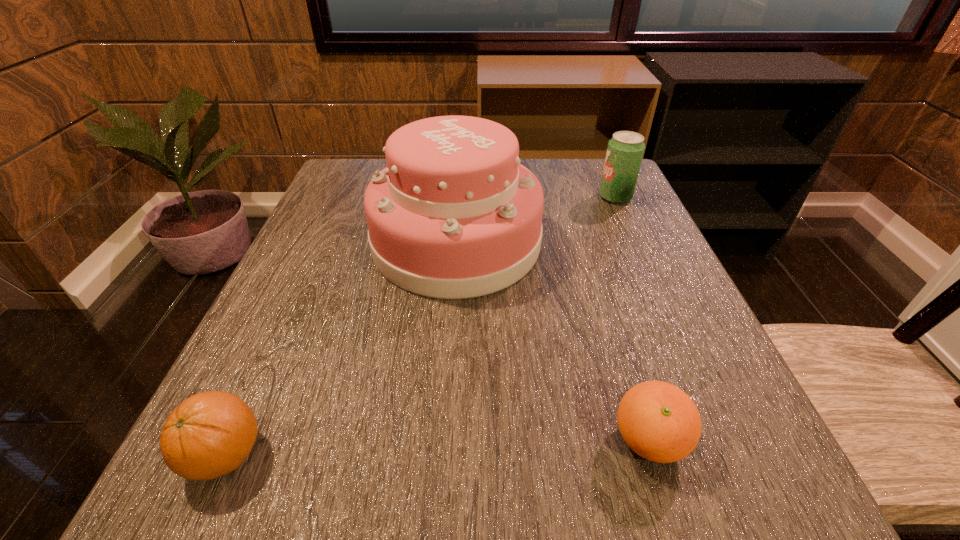
Find the location of a particular element. birthday cake is located at coordinates (454, 215).

Where is `the second object from left to right`? the second object from left to right is located at coordinates (454, 215).

Find the location of `soda`. soda is located at coordinates (625, 150).

Image resolution: width=960 pixels, height=540 pixels. What are the coordinates of `the rightmost object` in the screenshot? It's located at (625, 150).

Where is `the left orange`? This screenshot has height=540, width=960. the left orange is located at coordinates (210, 434).

Where is `the third object from left to right`? the third object from left to right is located at coordinates (658, 421).

Locate an element on the screen. This screenshot has width=960, height=540. vacant space positioned 0.180m on the front of the tallest object is located at coordinates (446, 388).

Find the location of a particular element. vacant space located 0.260m on the left of the soda is located at coordinates (487, 197).

I want to click on free space located 0.390m on the right of the left orange, so click(574, 455).

The height and width of the screenshot is (540, 960). Identify the location of vacant region located 0.170m on the back of the third object from left to right. (612, 318).